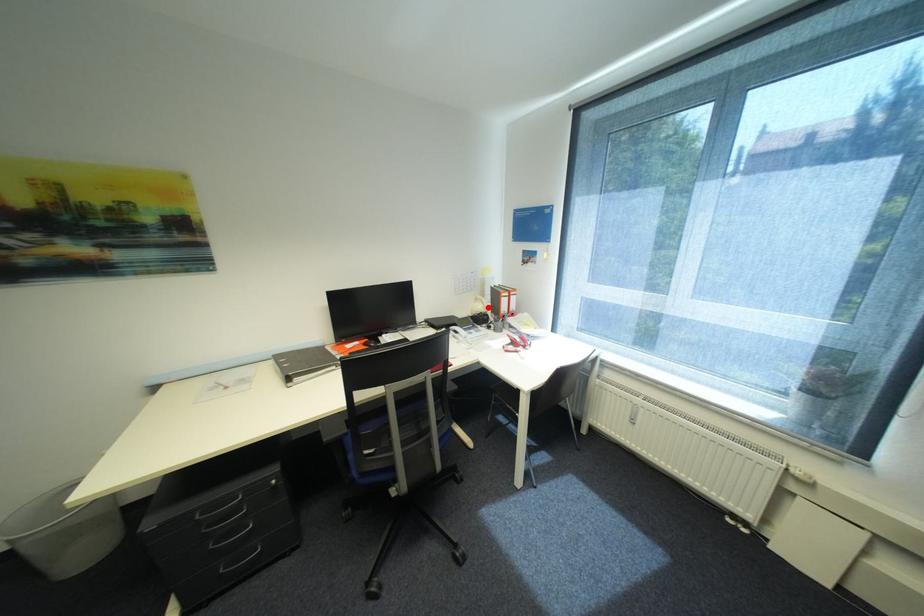
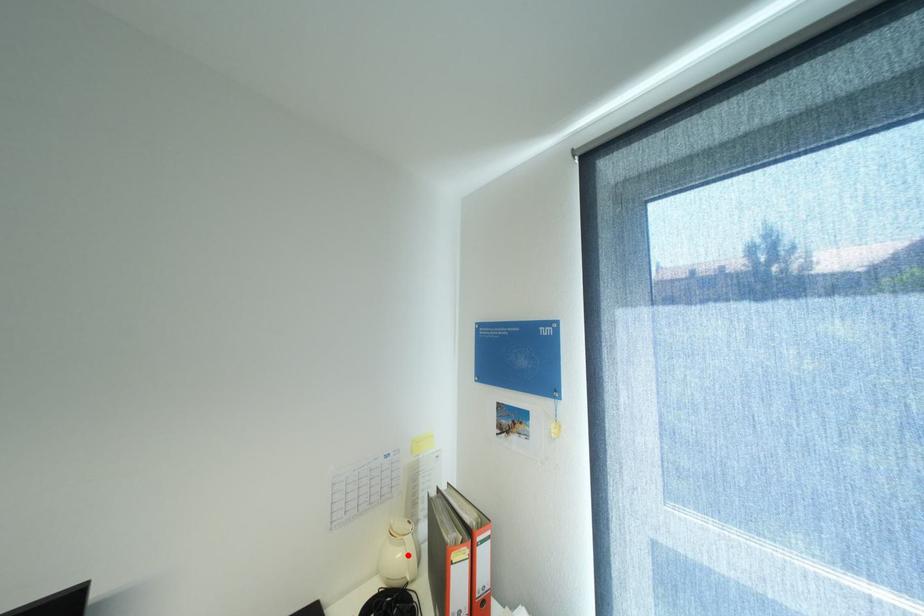
I am providing you with two images of the same scene from different viewpoints. A red point is marked on the first image and another point is marked on the second image. Is the red point in image1 aligned with the point shown in image2?

Yes